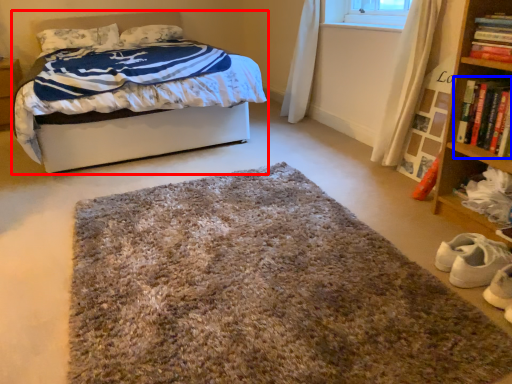
Question: Which object appears closest to the camera in this image, bed (highlighted by a red box) or book (highlighted by a blue box)?

Choices:
 (A) bed
 (B) book

Answer: (B)